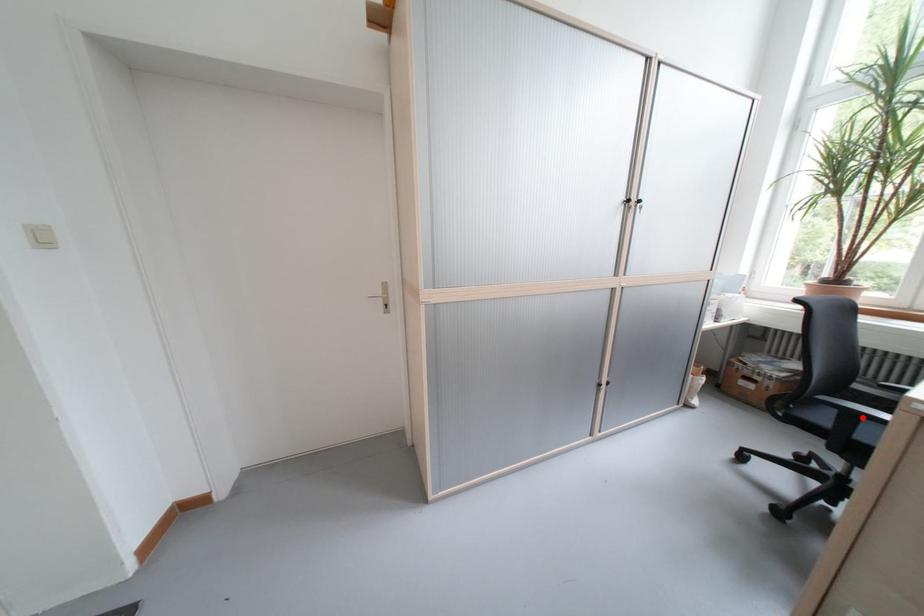
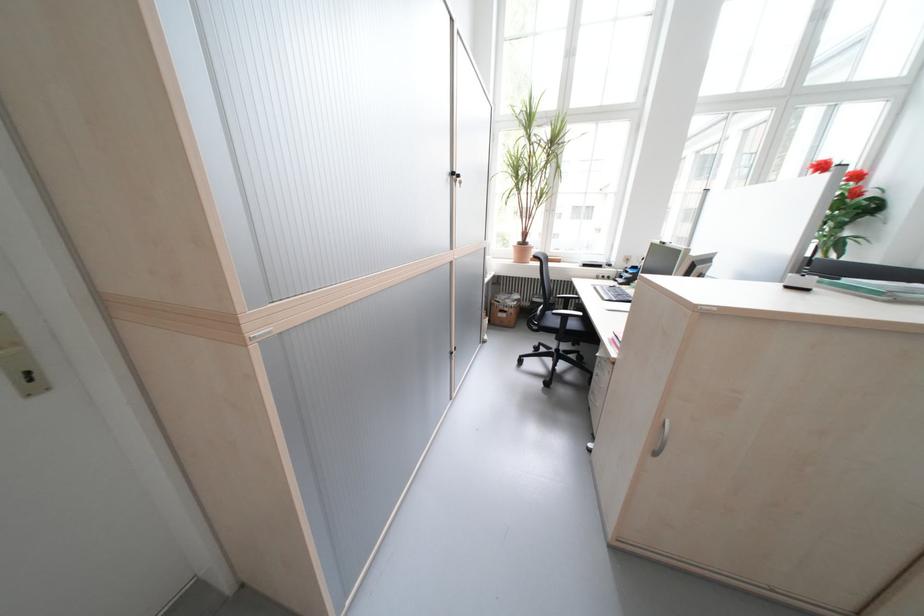
Question: I am providing you with two images of the same scene from different viewpoints. A red point is shown in image1. For the corresponding object point in image2, is it positioned nearer or farther from the camera?

Choices:
 (A) Nearer
 (B) Farther

Answer: (A)